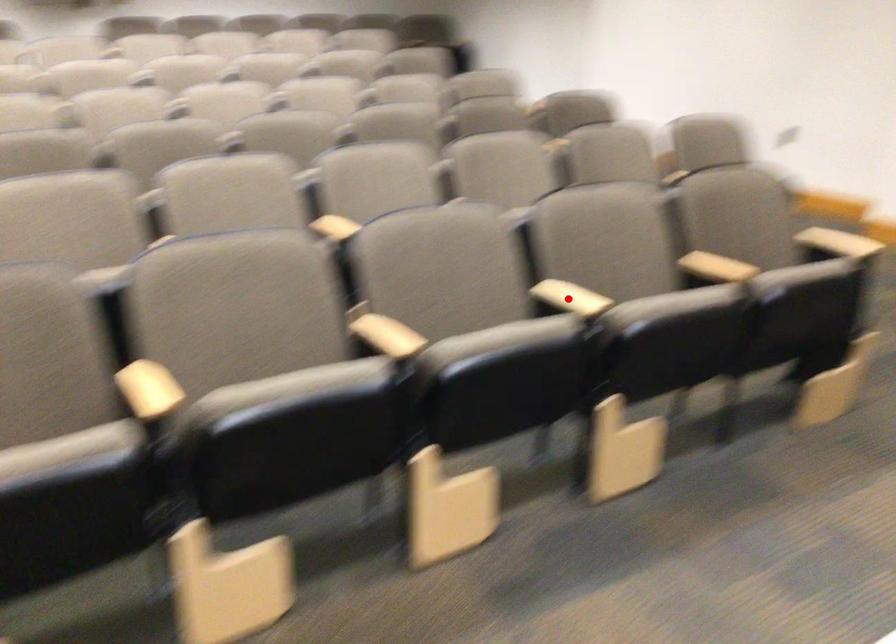
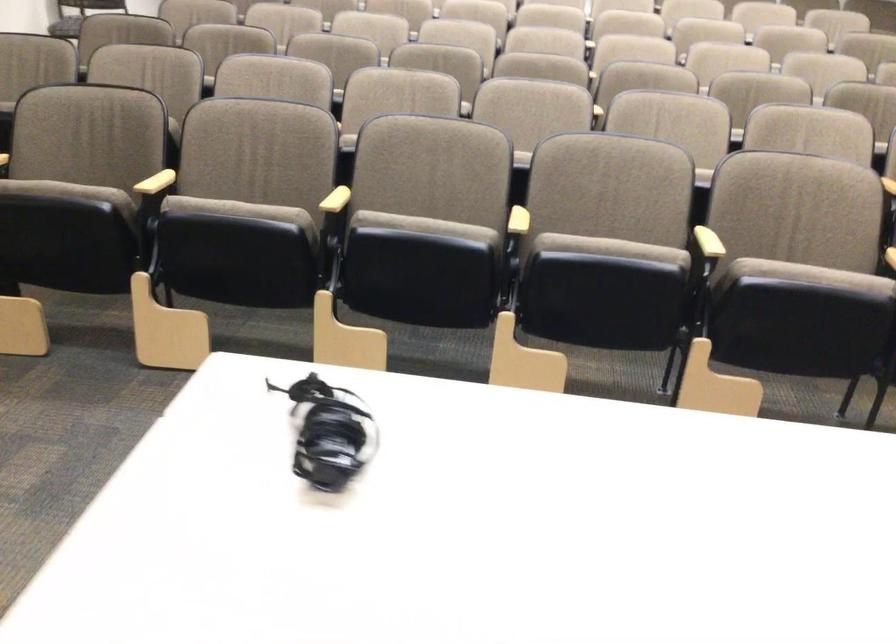
Find the pixel in the second image that matches the highlighted location in the first image.

(709, 242)